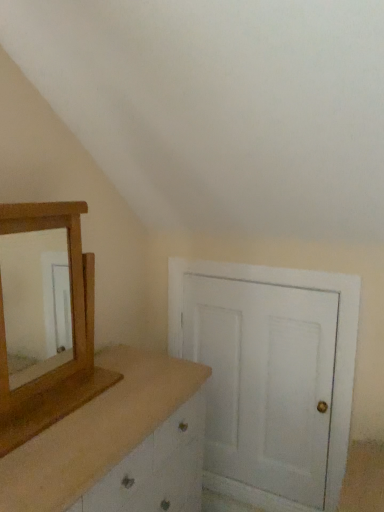
The image size is (384, 512). I want to click on wooden dresser at left, so click(111, 434).

Is point (322, 480) positioned before point (33, 426)?

That is False.

Looking at their sizes, would you say white matte door at center is wider or thinner than wooden mirror at left?

Considering their sizes, white matte door at center looks slimmer than wooden mirror at left.

Is white matte door at center aimed at wooden mirror at left?

Yes, white matte door at center faces towards wooden mirror at left.

Identify the location of door to the right of wooden mirror at left. The width and height of the screenshot is (384, 512). (265, 381).

Is wooden dresser at left wider or thinner than wooden mirror at left?

In the image, wooden dresser at left appears to be wider than wooden mirror at left.

Would you say wooden mirror at left is part of wooden dresser at left's contents?

No, wooden mirror at left is not a part of wooden dresser at left.

Are wooden dresser at left and wooden mirror at left located far from each other?

wooden dresser at left is actually quite close to wooden mirror at left.

Which object is positioned more to the left, wooden dresser at left or wooden mirror at left?

wooden mirror at left.

Is point (23, 405) closer or farther from the camera than point (158, 455)?

Point (23, 405) is closer to the camera than point (158, 455).

Is wooden mirror at left thinner than wooden dresser at left?

Indeed, wooden mirror at left has a lesser width compared to wooden dresser at left.

Which of these two, wooden mirror at left or wooden dresser at left, stands shorter?

Standing shorter between the two is wooden mirror at left.

Which object is further away from the camera taking this photo, wooden mirror at left or wooden dresser at left?

wooden mirror at left is further away from the camera.

Are wooden dresser at left and white matte door at center beside each other?

There is a gap between wooden dresser at left and white matte door at center.

Where is `the chest of drawers that appears below the white matte door at center (from the image's perspective)`? The height and width of the screenshot is (512, 384). the chest of drawers that appears below the white matte door at center (from the image's perspective) is located at coordinates click(x=111, y=434).

Which is correct: wooden dresser at left is inside white matte door at center, or outside of it?

wooden dresser at left exists outside the volume of white matte door at center.

From their relative heights in the image, would you say wooden dresser at left is taller or shorter than white matte door at center?

Clearly, wooden dresser at left is shorter compared to white matte door at center.

From a real-world perspective, is wooden mirror at left physically located above or below white matte door at center?

From a real-world perspective, wooden mirror at left is physically above white matte door at center.

How different are the orientations of wooden mirror at left and white matte door at center in degrees?

The facing directions of wooden mirror at left and white matte door at center are 90.7 degrees apart.

From the picture: Is wooden mirror at left facing away from white matte door at center?

No, wooden mirror at left is not facing the opposite direction of white matte door at center.

Which is closer to the camera, [85,298] or [324,482]?

Positioned in front is point [85,298].

From the image's perspective, between white matte door at center and wooden dresser at left, who is located below?

wooden dresser at left is shown below in the image.

From a real-world perspective, relative to wooden dresser at left, is white matte door at center vertically above or below?

white matte door at center is above wooden dresser at left.

Considering the relative sizes of white matte door at center and wooden dresser at left in the image provided, is white matte door at center bigger than wooden dresser at left?

Actually, white matte door at center might be smaller than wooden dresser at left.

Is point (298, 364) positioned before point (118, 441)?

No, (298, 364) is further to viewer.

This screenshot has width=384, height=512. What are the coordinates of `medicine cabinet on the left of white matte door at center` in the screenshot? It's located at (72, 334).

Identify the location of medicine cabinet positioned vertically above the wooden dresser at left (from a real-world perspective). Image resolution: width=384 pixels, height=512 pixels. (72, 334).

Based on the photo, from the image, which object appears to be nearer to wooden mirror at left, wooden dresser at left or white matte door at center?

Based on the image, wooden dresser at left appears to be nearer to wooden mirror at left.

Estimate the real-world distances between objects in this image. Which object is further from wooden mirror at left, white matte door at center or wooden dresser at left?

white matte door at center is positioned further to the anchor wooden mirror at left.

From the picture: Based on their spatial positions, is wooden dresser at left or wooden mirror at left further from white matte door at center?

wooden mirror at left.

Based on their spatial positions, is white matte door at center or wooden mirror at left further from wooden dresser at left?

white matte door at center is positioned further to the anchor wooden dresser at left.

Estimate the real-world distances between objects in this image. Which object is further from wooden dresser at left, wooden mirror at left or white matte door at center?

The object further to wooden dresser at left is white matte door at center.

Looking at this image, based on their spatial positions, is wooden mirror at left or wooden dresser at left further from white matte door at center?

Among the two, wooden mirror at left is located further to white matte door at center.

Locate an element on the screen. This screenshot has width=384, height=512. medicine cabinet between wooden dresser at left and white matte door at center in the front-back direction is located at coordinates (72, 334).